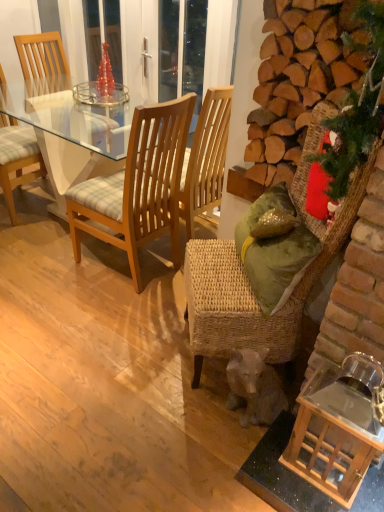
Question: Considering the positions of green fabric christmas tree at right and woodenchair at left, positioned as the 3th chair in left-to-right order, in the image, is green fabric christmas tree at right taller or shorter than woodenchair at left, positioned as the 3th chair in left-to-right order,?

Choices:
 (A) tall
 (B) short

Answer: (B)

Question: Which is correct: green fabric christmas tree at right is inside woodenchair at left, acting as the second chair starting from the right, or outside of it?

Choices:
 (A) outside
 (B) inside

Answer: (A)

Question: Estimate the real-world distances between objects in this image. Which object is closer to the light brown wooden chair at left, marked as the third chair in a right-to-left arrangement?

Choices:
 (A) green fabric christmas tree at right
 (B) woodenchair at left, positioned as the 3th chair in left-to-right order
 (C) green fabric pillow at right
 (D) wooden chair at left, arranged as the fourth chair when viewed from the right
 (E) woven wicker chair at right, which is counted as the 1th chair, starting from the right

Answer: (D)

Question: Based on their relative distances, which object is nearer to the wooden chair at left, the first chair when ordered from left to right?

Choices:
 (A) woodenchair at left, acting as the second chair starting from the right
 (B) green fabric christmas tree at right
 (C) woven wicker chair at right, which is counted as the 4th chair, starting from the left
 (D) green fabric pillow at right
 (E) light brown wooden chair at left, the second chair in the left-to-right sequence

Answer: (E)